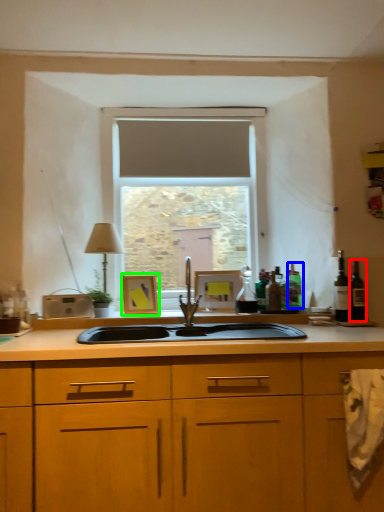
Question: Estimate the real-world distances between objects in this image. Which object is closer to wine bottle (highlighted by a red box), bottle (highlighted by a blue box) or picture frame (highlighted by a green box)?

Choices:
 (A) bottle
 (B) picture frame

Answer: (A)